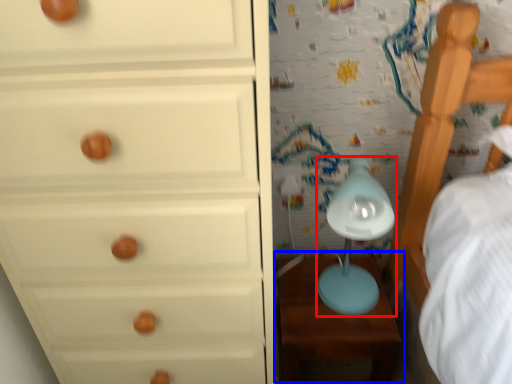
Question: Which point is closer to the camera, table lamp (highlighted by a red box) or table (highlighted by a blue box)?

Choices:
 (A) table lamp
 (B) table

Answer: (A)